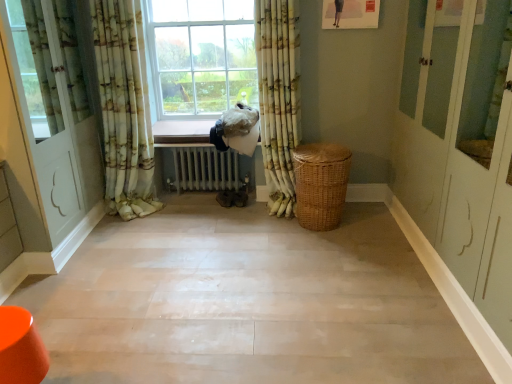
At what (x,y) coordinates should I click in order to perform the action: click on free point above smooth beige floor at center (from a real-world perspective). Please return your answer as a coordinate pair (x, y). The height and width of the screenshot is (384, 512). Looking at the image, I should click on (190, 271).